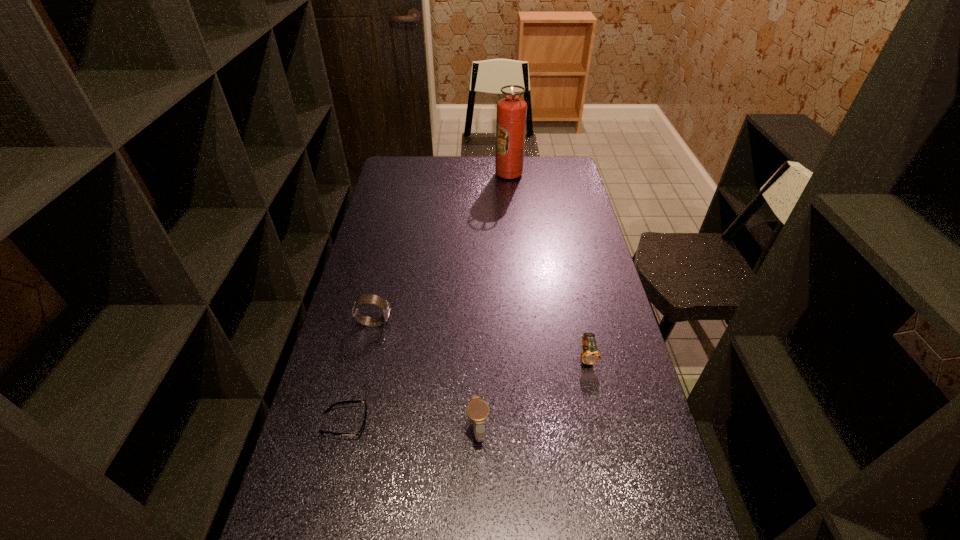
Where is `free space at the far edge of the desktop`? free space at the far edge of the desktop is located at coordinates (436, 176).

The height and width of the screenshot is (540, 960). Find the location of `free space at the left edge of the desktop`. free space at the left edge of the desktop is located at coordinates (385, 243).

In the image, there is a desktop. At what (x,y) coordinates should I click in order to perform the action: click on vacant space at the right edge. Please return your answer as a coordinate pair (x, y). Looking at the image, I should click on (594, 284).

Locate an element on the screen. The width and height of the screenshot is (960, 540). vacant space at the far left corner of the desktop is located at coordinates (409, 175).

Where is `free spot between the tallest object and the third nearest object`? The height and width of the screenshot is (540, 960). free spot between the tallest object and the third nearest object is located at coordinates (548, 265).

At what (x,y) coordinates should I click in order to perform the action: click on free space between the second nearest watch and the leftmost watch. Please return your answer as a coordinate pair (x, y). The width and height of the screenshot is (960, 540). Looking at the image, I should click on (481, 340).

Where is `free space between the tallest object and the leftmost watch`? The image size is (960, 540). free space between the tallest object and the leftmost watch is located at coordinates (442, 248).

You are a GUI agent. You are given a task and a screenshot of the screen. Output one action in this format:
    pyautogui.click(x=<x>, y=<y>)
    Task: Click on the vacant space that's between the second watch from right to left and the second farthest watch
    The height and width of the screenshot is (540, 960).
    Given the screenshot: What is the action you would take?
    pyautogui.click(x=533, y=393)

You are a GUI agent. You are given a task and a screenshot of the screen. Output one action in this format:
    pyautogui.click(x=<x>, y=<y>)
    Task: Click on the empty space between the sunglasses and the rightmost object
    The width and height of the screenshot is (960, 540).
    Given the screenshot: What is the action you would take?
    pyautogui.click(x=466, y=390)

The width and height of the screenshot is (960, 540). I want to click on empty space between the third object from right to left and the tallest object, so click(x=493, y=302).